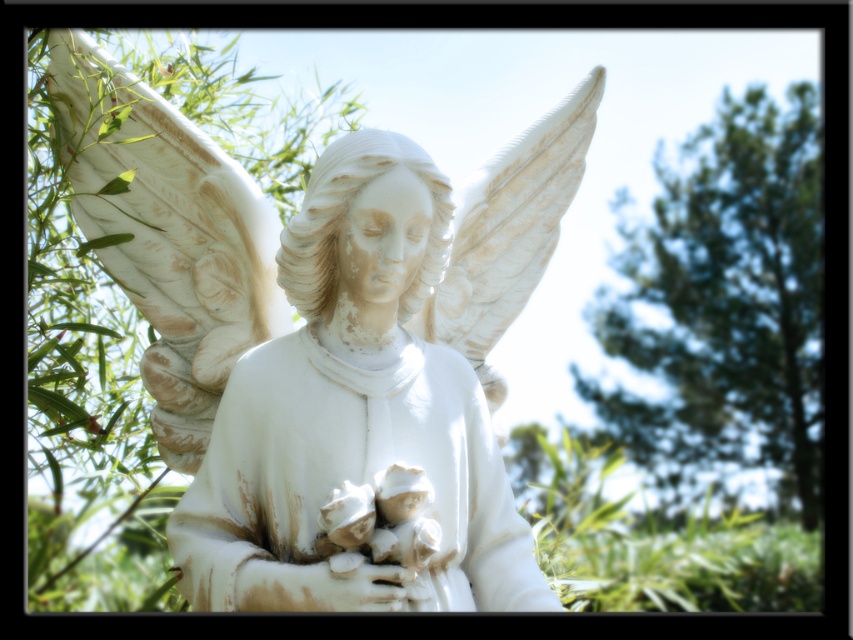
Question: Does green leafy tree at upper right have a lesser width compared to white matte hand at center?

Choices:
 (A) yes
 (B) no

Answer: (B)

Question: Which point is farther from the camera taking this photo?

Choices:
 (A) (230, 218)
 (B) (402, 577)
 (C) (753, 403)

Answer: (C)

Question: Is the position of green leafy tree at upper right less distant than that of white matte hand at center?

Choices:
 (A) yes
 (B) no

Answer: (B)

Question: Considering the real-world distances, which object is farthest from the white matte hand at center?

Choices:
 (A) green leafy tree at upper right
 (B) white marble statue at center

Answer: (A)

Question: Which point is closer to the camera taking this photo?

Choices:
 (A) (664, 189)
 (B) (389, 595)
 (C) (229, 161)

Answer: (B)

Question: Is white marble statue at center positioned behind green leafy tree at upper right?

Choices:
 (A) no
 (B) yes

Answer: (A)